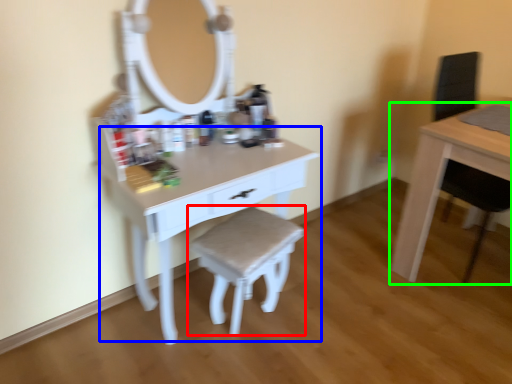
Question: Considering the real-world distances, which object is farthest from stool (highlighted by a red box)? table (highlighted by a blue box) or table (highlighted by a green box)?

Choices:
 (A) table
 (B) table

Answer: (B)